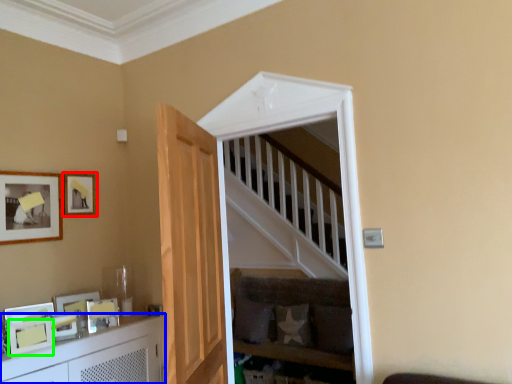
Question: Which object is positioned closest to picture frame (highlighted by a red box)? Select from cabinetry (highlighted by a blue box) and picture frame (highlighted by a green box).

Choices:
 (A) cabinetry
 (B) picture frame

Answer: (B)